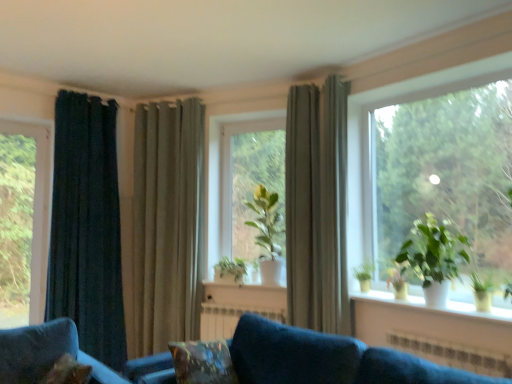
Question: Does green matte plant at center, which appears as the 3th houseplant when viewed from the front, have a lesser width compared to satin beige curtain at center, which is counted as the third curtain, starting from the left?

Choices:
 (A) yes
 (B) no

Answer: (B)

Question: Considering the relative sizes of green matte plant at center, marked as the first houseplant in a left-to-right arrangement, and satin beige curtain at center, which is counted as the third curtain, starting from the left, in the image provided, is green matte plant at center, marked as the first houseplant in a left-to-right arrangement, taller than satin beige curtain at center, which is counted as the third curtain, starting from the left,?

Choices:
 (A) no
 (B) yes

Answer: (A)

Question: Does green matte plant at center, which appears as the 3th houseplant when viewed from the front, lie in front of satin beige curtain at center, which is counted as the third curtain, starting from the left?

Choices:
 (A) yes
 (B) no

Answer: (B)

Question: From a real-world perspective, does green matte plant at center, marked as the first houseplant in a left-to-right arrangement, stand above satin beige curtain at center, positioned as the first curtain in right-to-left order?

Choices:
 (A) yes
 (B) no

Answer: (B)

Question: From the image's perspective, would you say green matte plant at center, which appears as the 3th houseplant when viewed from the front, is shown under satin beige curtain at center, positioned as the first curtain in right-to-left order?

Choices:
 (A) yes
 (B) no

Answer: (A)

Question: Considering the relative positions of green matte plant at center, acting as the 1th houseplant starting from the back, and satin beige curtain at center, positioned as the first curtain in right-to-left order, in the image provided, is green matte plant at center, acting as the 1th houseplant starting from the back, to the left of satin beige curtain at center, positioned as the first curtain in right-to-left order, from the viewer's perspective?

Choices:
 (A) yes
 (B) no

Answer: (A)

Question: From the image's perspective, would you say velvet blue couch at lower center is shown under white ceramic plant pots at lower right?

Choices:
 (A) no
 (B) yes

Answer: (B)

Question: Is white ceramic plant pots at lower right located within velvet blue couch at lower center?

Choices:
 (A) yes
 (B) no

Answer: (B)

Question: Is velvet blue couch at lower center oriented away from white ceramic plant pots at lower right?

Choices:
 (A) no
 (B) yes

Answer: (B)

Question: Can you confirm if velvet blue couch at lower center is bigger than white ceramic plant pots at lower right?

Choices:
 (A) no
 (B) yes

Answer: (B)

Question: Does velvet blue couch at lower center appear on the right side of white ceramic plant pots at lower right?

Choices:
 (A) no
 (B) yes

Answer: (A)

Question: Is velvet blue couch at lower center not close to white ceramic plant pots at lower right?

Choices:
 (A) yes
 (B) no

Answer: (B)

Question: Considering the relative sizes of velvety brown pillow at lower center and velvet blue couch at lower center in the image provided, is velvety brown pillow at lower center thinner than velvet blue couch at lower center?

Choices:
 (A) no
 (B) yes

Answer: (B)